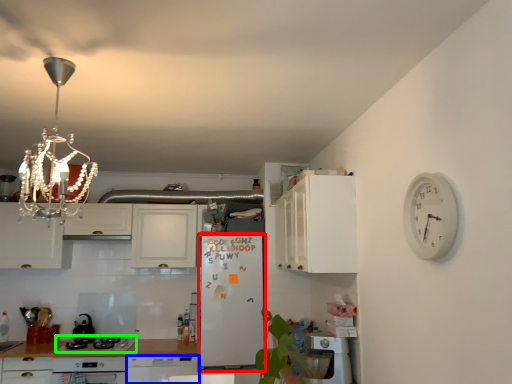
Question: Considering the real-world distances, which object is farthest from fridge (highlighted by a red box)? dish washer (highlighted by a blue box) or kitchen appliance (highlighted by a green box)?

Choices:
 (A) dish washer
 (B) kitchen appliance

Answer: (B)